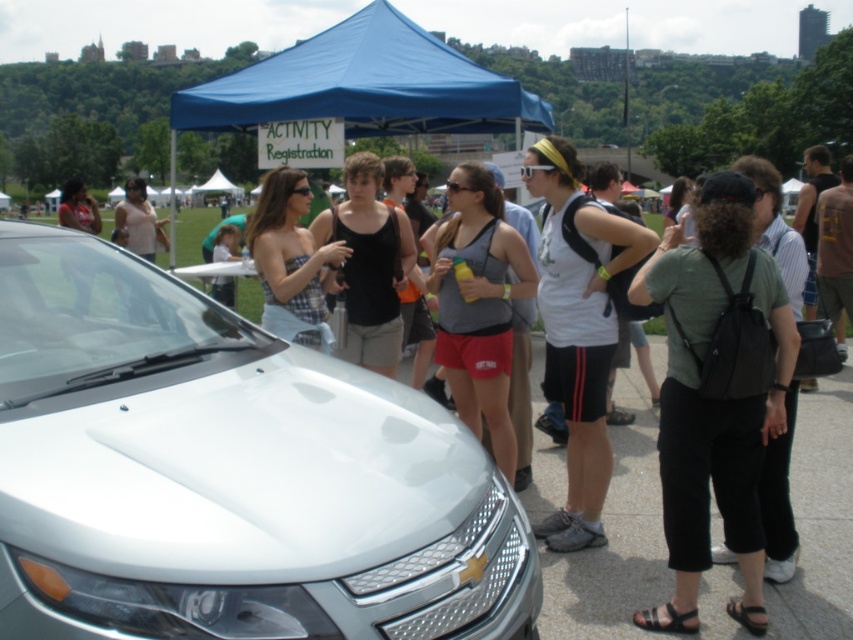
Is white matte tank top at center further to camera compared to plaid fabric dress at center?

No.

Is white matte tank top at center positioned in front of plaid fabric dress at center?

Yes, it is.

Is point (589, 486) in front of point (286, 205)?

Yes, it is.

Identify the location of white matte tank top at center. point(578,332).

Which of these two, gray matte tank top at center or black matte tank top at center, stands shorter?

With less height is black matte tank top at center.

Can you confirm if gray matte tank top at center is wider than black matte tank top at center?

Yes, gray matte tank top at center is wider than black matte tank top at center.

Who is more forward, (498, 339) or (352, 355)?

Point (498, 339) is in front.

I want to click on gray matte tank top at center, so click(x=479, y=307).

Can you confirm if white glossy car at center is wider than white matte tank top at center?

Yes.

How distant is white glossy car at center from white matte tank top at center?

white glossy car at center is 2.00 meters away from white matte tank top at center.

Is point (392, 611) positioned after point (601, 324)?

No, it is in front of (601, 324).

Locate an element on the screen. white glossy car at center is located at coordinates (225, 474).